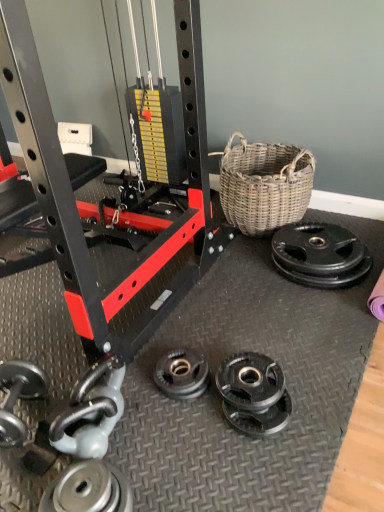
Question: Is silver metallic dumbbell at lower left with silver metallic weight plate at lower left, arranged as the first wheel when viewed from the front?

Choices:
 (A) no
 (B) yes

Answer: (A)

Question: From the image's perspective, does silver metallic dumbbell at lower left appear higher than silver metallic weight plate at lower left, the 1th wheel when ordered from bottom to top?

Choices:
 (A) no
 (B) yes

Answer: (B)

Question: Can you confirm if silver metallic dumbbell at lower left is positioned to the right of silver metallic weight plate at lower left, which ranks as the second wheel in right-to-left order?

Choices:
 (A) no
 (B) yes

Answer: (A)

Question: Does silver metallic dumbbell at lower left come behind silver metallic weight plate at lower left, the first wheel positioned from the left?

Choices:
 (A) no
 (B) yes

Answer: (B)

Question: From a real-world perspective, is silver metallic dumbbell at lower left positioned under silver metallic weight plate at lower left, the first wheel positioned from the left, based on gravity?

Choices:
 (A) yes
 (B) no

Answer: (B)

Question: From a real-world perspective, is silver metallic dumbbell at lower left located higher than silver metallic weight plate at lower left, which ranks as the second wheel in right-to-left order?

Choices:
 (A) no
 (B) yes

Answer: (B)

Question: Would you say black rubber weight plate at right, the second wheel in the left-to-right sequence, is part of silver metallic dumbbell at lower left's contents?

Choices:
 (A) yes
 (B) no

Answer: (B)

Question: Is the depth of silver metallic dumbbell at lower left greater than that of black rubber weight plate at right, the second wheel in the left-to-right sequence?

Choices:
 (A) no
 (B) yes

Answer: (A)

Question: Is silver metallic dumbbell at lower left bigger than black rubber weight plate at right, which ranks as the first wheel in right-to-left order?

Choices:
 (A) yes
 (B) no

Answer: (B)

Question: Considering the relative positions of silver metallic dumbbell at lower left and black rubber weight plate at right, acting as the 2th wheel starting from the front, in the image provided, is silver metallic dumbbell at lower left in front of black rubber weight plate at right, acting as the 2th wheel starting from the front,?

Choices:
 (A) yes
 (B) no

Answer: (A)

Question: Considering the relative sizes of silver metallic dumbbell at lower left and black rubber weight plate at right, positioned as the first wheel in back-to-front order, in the image provided, is silver metallic dumbbell at lower left taller than black rubber weight plate at right, positioned as the first wheel in back-to-front order,?

Choices:
 (A) yes
 (B) no

Answer: (A)

Question: Is silver metallic dumbbell at lower left at the right side of black rubber weight plate at right, the second wheel in the left-to-right sequence?

Choices:
 (A) no
 (B) yes

Answer: (A)

Question: Is black rubber weight plate at right, the second wheel positioned from the bottom, further to the viewer compared to silver metallic weight plate at lower left, which ranks as the second wheel in right-to-left order?

Choices:
 (A) yes
 (B) no

Answer: (A)